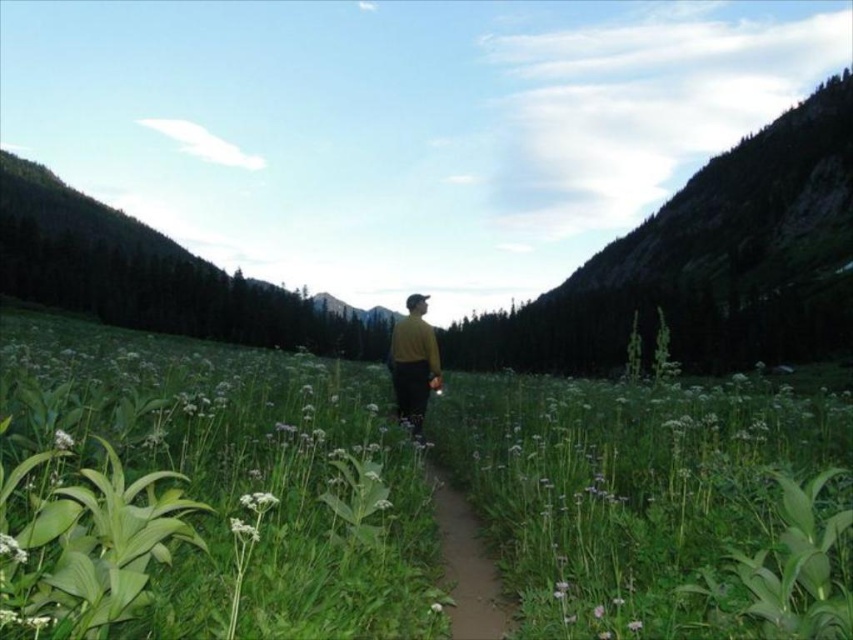
This screenshot has width=853, height=640. What do you see at coordinates (258, 500) in the screenshot?
I see `white fuzzy flower at lower center` at bounding box center [258, 500].

Between white fuzzy flower at lower center and white fluffy flower at center, which one has more height?

white fuzzy flower at lower center is taller.

Does point (247, 497) come behind point (440, 608)?

That is False.

This screenshot has height=640, width=853. What are the coordinates of `white fuzzy flower at lower center` in the screenshot? It's located at (258, 500).

At what (x,y) coordinates should I click in order to perform the action: click on green leafy grass at center. Please return your answer as a coordinate pair (x, y). Looking at the image, I should click on (404, 497).

Consider the image. Does green leafy grass at center have a lesser width compared to pink matte flower at center?

Incorrect, green leafy grass at center's width is not less than pink matte flower at center's.

Locate an element on the screen. green leafy grass at center is located at coordinates (404, 497).

Does white fuzzy flower at center have a lesser height compared to white fluffy flower at center?

Incorrect, white fuzzy flower at center's height does not fall short of white fluffy flower at center's.

Does white fuzzy flower at center lie behind white fluffy flower at center?

That is True.

The image size is (853, 640). Describe the element at coordinates (381, 504) in the screenshot. I see `white fuzzy flower at center` at that location.

The width and height of the screenshot is (853, 640). I want to click on white fuzzy flower at center, so click(x=381, y=504).